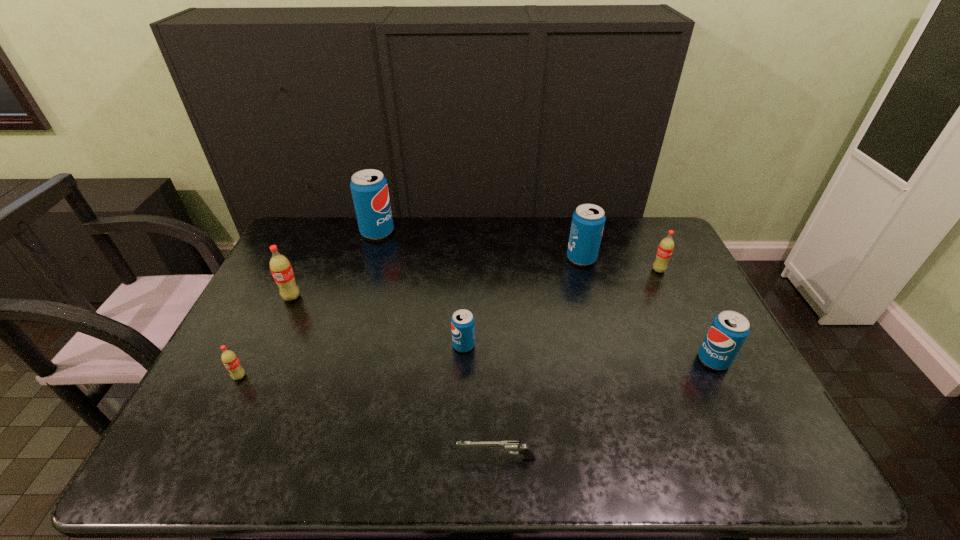
Where is `the fourth soda from right to left`? This screenshot has width=960, height=540. the fourth soda from right to left is located at coordinates click(x=462, y=322).

Locate an element on the screen. the nearest red soda is located at coordinates (229, 358).

I want to click on pistol, so click(x=509, y=446).

Locate an element on the screen. The height and width of the screenshot is (540, 960). the shortest object is located at coordinates (509, 446).

In order to click on vacant region located on the left of the tallest soda in this screenshot , I will do [347, 232].

The height and width of the screenshot is (540, 960). In order to click on vacant space located 0.090m on the left of the third smallest blue soda can in this screenshot , I will do `click(540, 258)`.

The height and width of the screenshot is (540, 960). In order to click on free space located on the back of the second nearest red soda in this screenshot , I will do `click(319, 238)`.

You are a GUI agent. You are given a task and a screenshot of the screen. Output one action in this format:
    pyautogui.click(x=<x>, y=<y>)
    Task: Click on the blank space located 0.270m on the left of the farthest red soda
    
    Given the screenshot: What is the action you would take?
    pyautogui.click(x=570, y=270)

Locate an element on the screen. vacant space located 0.400m on the back of the second smallest blue soda can is located at coordinates (662, 257).

You are a GUI agent. You are given a task and a screenshot of the screen. Output one action in this format:
    pyautogui.click(x=<x>, y=<y>)
    Task: Click on the blank area located on the back of the fourth soda from right to left
    
    Given the screenshot: What is the action you would take?
    pyautogui.click(x=466, y=298)